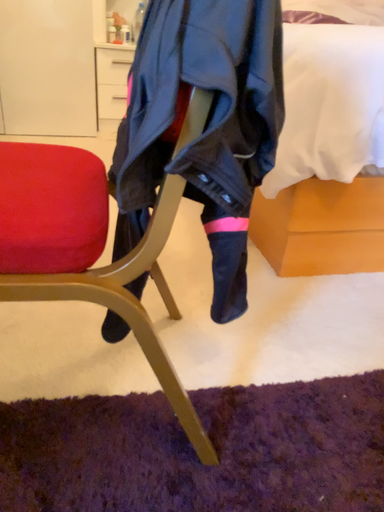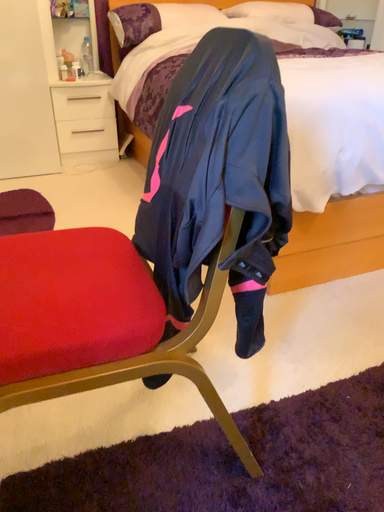
Question: Which way did the camera rotate in the video?

Choices:
 (A) rotated right
 (B) rotated left

Answer: (A)